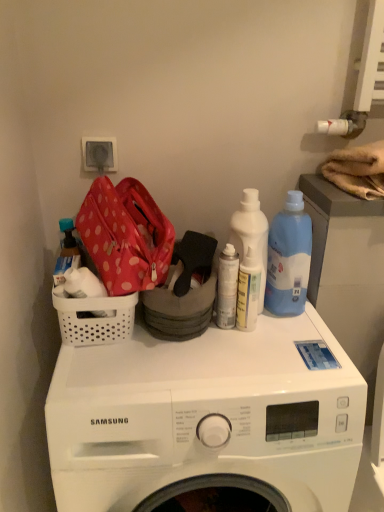
Locate an element on the screen. Image resolution: width=384 pixels, height=512 pixels. vacant space to the right of white plastic basket at left is located at coordinates (173, 356).